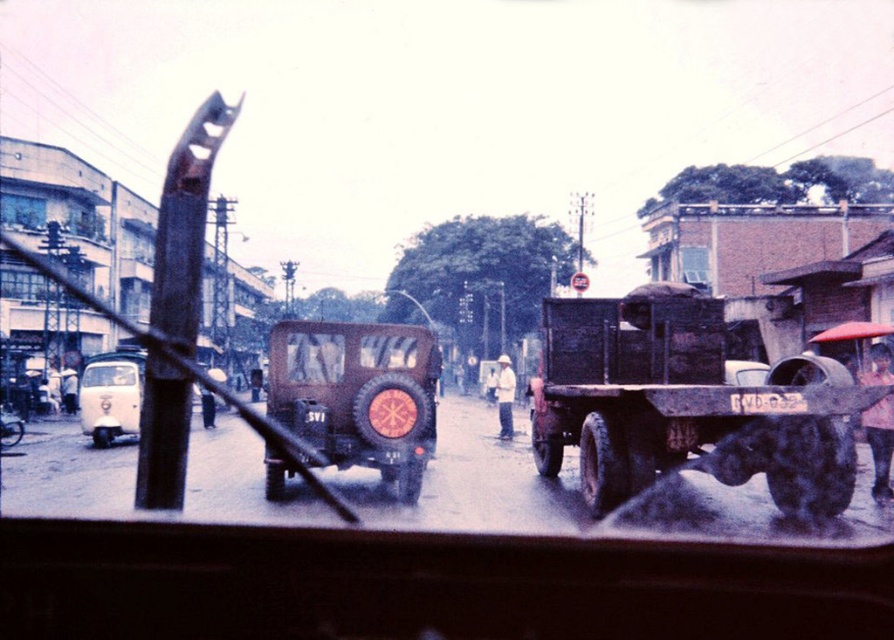
Question: Does matte brown military vehicle at center come behind white matte van at left?

Choices:
 (A) yes
 (B) no

Answer: (A)

Question: Which of the following is the farthest from the observer?

Choices:
 (A) matte brown military vehicle at center
 (B) white plastic license plate at center
 (C) rusty metal truck at right

Answer: (A)

Question: Estimate the real-world distances between objects in this image. Which object is farther from the matte brown military vehicle at center?

Choices:
 (A) white plastic license plate at center
 (B) white matte van at left
 (C) rusty metal truck at right

Answer: (B)

Question: Does matte brown military vehicle at center appear over white plastic license plate at center?

Choices:
 (A) yes
 (B) no

Answer: (B)

Question: Does matte brown military vehicle at center appear on the right side of white matte van at left?

Choices:
 (A) yes
 (B) no

Answer: (A)

Question: Which point is closer to the camera?

Choices:
 (A) (89, 371)
 (B) (561, 307)
 (C) (306, 333)

Answer: (C)